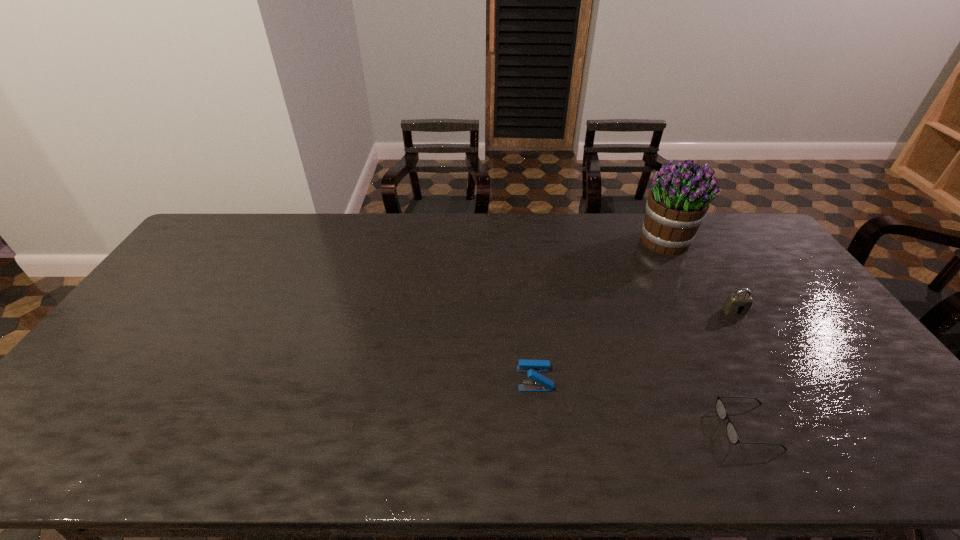
Select which object appears as the closest to the leftmost object. Please provide its 2D coordinates. Your answer should be formatted as a tuple, i.e. [(x, y)], where the tuple contains the x and y coordinates of a point satisfying the conditions above.

[(732, 434)]

Where is `object that is the third nearest to the bouquet`? The width and height of the screenshot is (960, 540). object that is the third nearest to the bouquet is located at coordinates (541, 383).

Locate an element on the screen. free space that satisfies the following two spatial constraints: 1. on the back side of the second shortest object; 2. on the left side of the tallest object is located at coordinates (519, 242).

This screenshot has width=960, height=540. What are the coordinates of `free space that satisfies the following two spatial constraints: 1. at the front of the second tallest object near the keyhole; 2. on the front-facing side of the nearest object` in the screenshot? It's located at (804, 427).